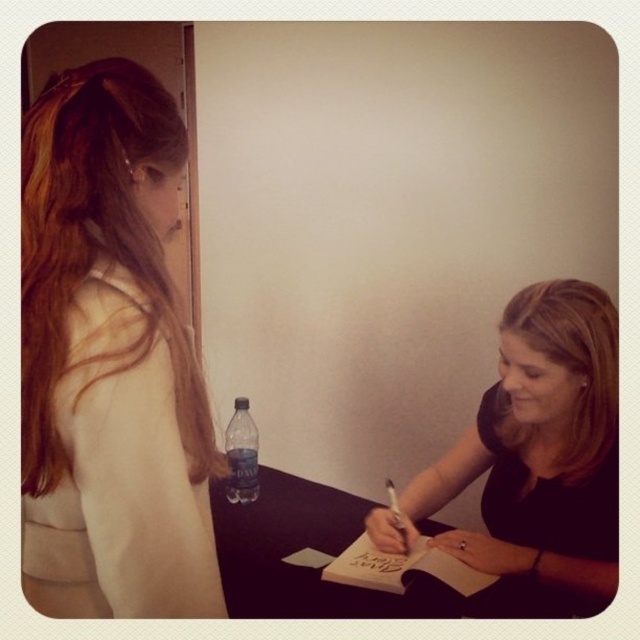
Is point (140, 408) farther from camera compared to point (310, 516)?

No, (140, 408) is in front of (310, 516).

Is the position of matte beige sweater at left less distant than that of black matte table at center?

Yes, matte beige sweater at left is closer to the viewer.

Who is more distant from viewer, (220, 584) or (284, 509)?

The point (284, 509) is more distant.

What are the coordinates of `matte beige sweater at left` in the screenshot? It's located at (109, 358).

Which is behind, point (67, 396) or point (349, 560)?

The point (349, 560) is behind.

Can you confirm if matte beige sweater at left is positioned to the right of smooth paper note at lower center?

Incorrect, matte beige sweater at left is not on the right side of smooth paper note at lower center.

The height and width of the screenshot is (640, 640). Describe the element at coordinates (109, 358) in the screenshot. I see `matte beige sweater at left` at that location.

At what (x,y) coordinates should I click in order to perform the action: click on matte beige sweater at left. Please return your answer as a coordinate pair (x, y). This screenshot has width=640, height=640. Looking at the image, I should click on (109, 358).

Which is behind, point (596, 417) or point (253, 468)?

The point (253, 468) is behind.

Between black matte pen at center and transparent plastic bottle at center, which one has less height?

transparent plastic bottle at center

The height and width of the screenshot is (640, 640). In order to click on black matte pen at center in this screenshot , I will do `click(541, 451)`.